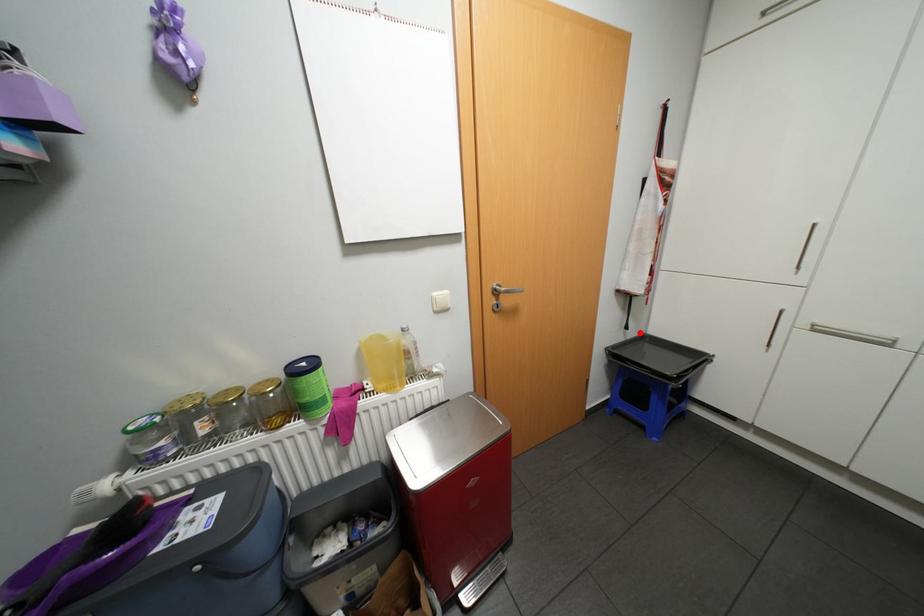
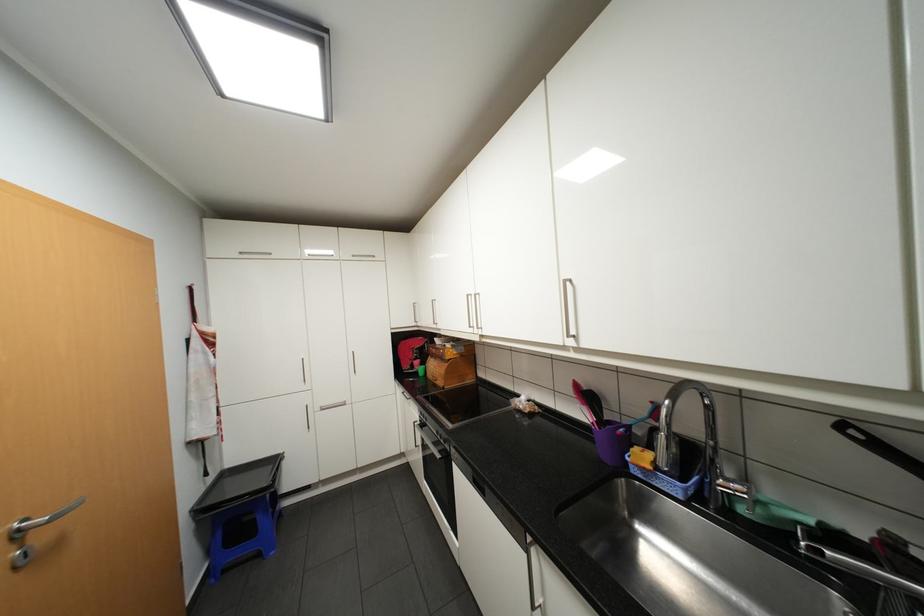
The point at the highlighted location is marked in the first image. Where is the corresponding point in the second image?

(220, 476)